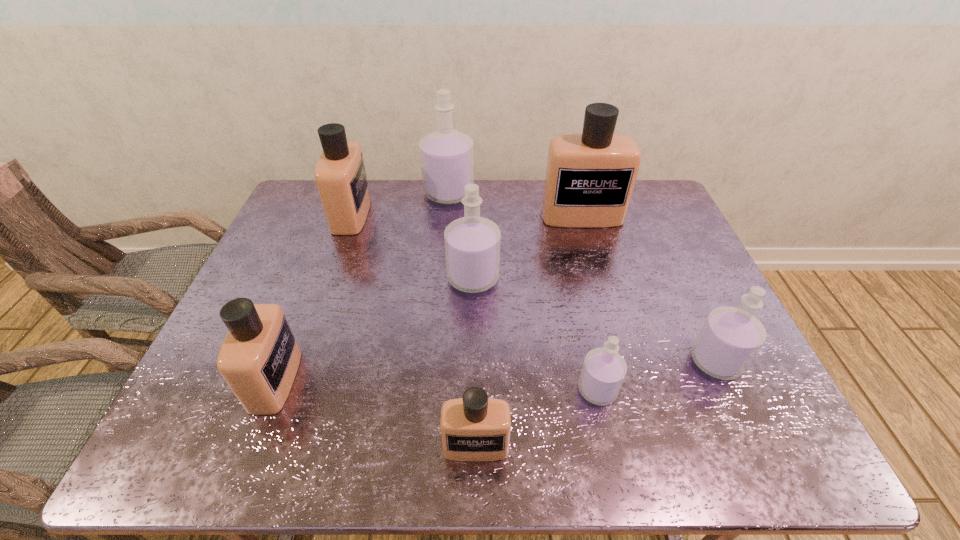
Locate which purple perfume ranks second in proximity to the rightmost object. Please provide its 2D coordinates. Your answer should be formatted as a tuple, i.e. [(x, y)], where the tuple contains the x and y coordinates of a point satisfying the conditions above.

[(472, 243)]

At what (x,y) coordinates should I click in order to perform the action: click on purple perfume that is the second closest to the biggest purple perfume. Please return your answer as a coordinate pair (x, y). Looking at the image, I should click on (603, 371).

Where is `beige perfume that is the closest one to the rightmost perfume`? This screenshot has width=960, height=540. beige perfume that is the closest one to the rightmost perfume is located at coordinates (590, 177).

Identify the location of beige perfume that stands as the closest to the farthest purple perfume. The image size is (960, 540). (340, 175).

At what (x,y) coordinates should I click in order to perform the action: click on free space that satisfies the following two spatial constraints: 1. on the front label of the second biggest beige perfume; 2. on the back side of the third purple perfume from left to right. Please return your answer as a coordinate pair (x, y). Image resolution: width=960 pixels, height=540 pixels. Looking at the image, I should click on (290, 390).

The height and width of the screenshot is (540, 960). What are the coordinates of `free space that satisfies the following two spatial constraints: 1. on the front label of the rightmost perfume; 2. on the left side of the rightmost beige perfume` in the screenshot? It's located at (622, 361).

Identify the location of free space that satisfies the following two spatial constraints: 1. on the back side of the second purple perfume from right to left; 2. on the right side of the rightmost perfume. (591, 361).

The width and height of the screenshot is (960, 540). Find the location of `free space that satisfies the following two spatial constraints: 1. on the front label of the third farthest beige perfume; 2. on the right side of the second purple perfume from right to left`. free space that satisfies the following two spatial constraints: 1. on the front label of the third farthest beige perfume; 2. on the right side of the second purple perfume from right to left is located at coordinates (272, 390).

Where is `free space that satisfies the following two spatial constraints: 1. on the front label of the second smallest beige perfume; 2. on the back side of the third purple perfume from left to right`? The width and height of the screenshot is (960, 540). free space that satisfies the following two spatial constraints: 1. on the front label of the second smallest beige perfume; 2. on the back side of the third purple perfume from left to right is located at coordinates (272, 390).

At what (x,y) coordinates should I click in order to perform the action: click on vacant space that satisfies the following two spatial constraints: 1. on the front label of the third purple perfume from left to right; 2. on the left side of the third farthest beige perfume. Please return your answer as a coordinate pair (x, y). The image size is (960, 540). Looking at the image, I should click on (272, 390).